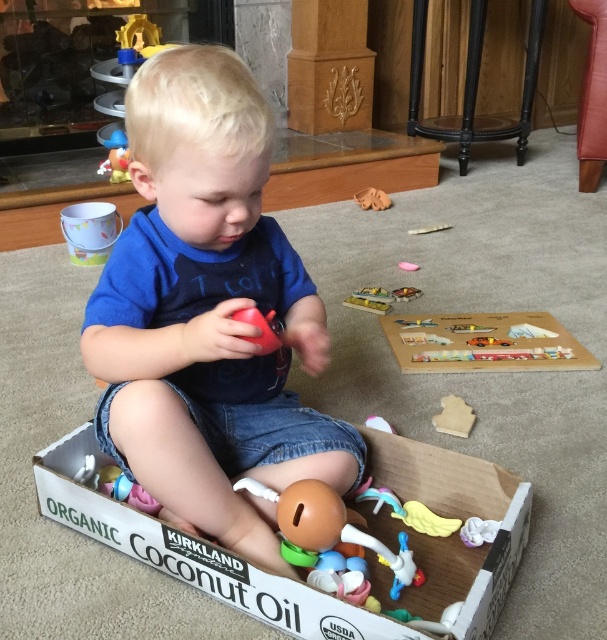
The child is sitting on the white cardboard box at center. If they want to reach the rubberized plastic ball at center, which direction should they move?

The rubberized plastic ball at center is to the right of the white cardboard box at center, so the child should move to the right to reach it.

You are a parent trying to organize the child play area. You see the white cardboard box at center and the brown fabric toy at center. Which object is located underneath the other?

The white cardboard box at center is positioned under brown fabric toy at center, so the white cardboard box is underneath the brown fabric toy.